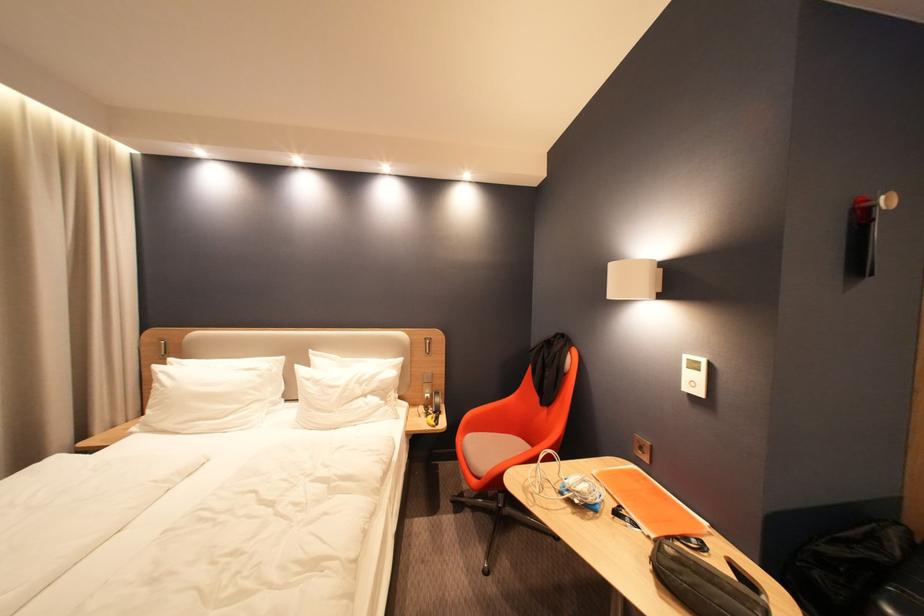
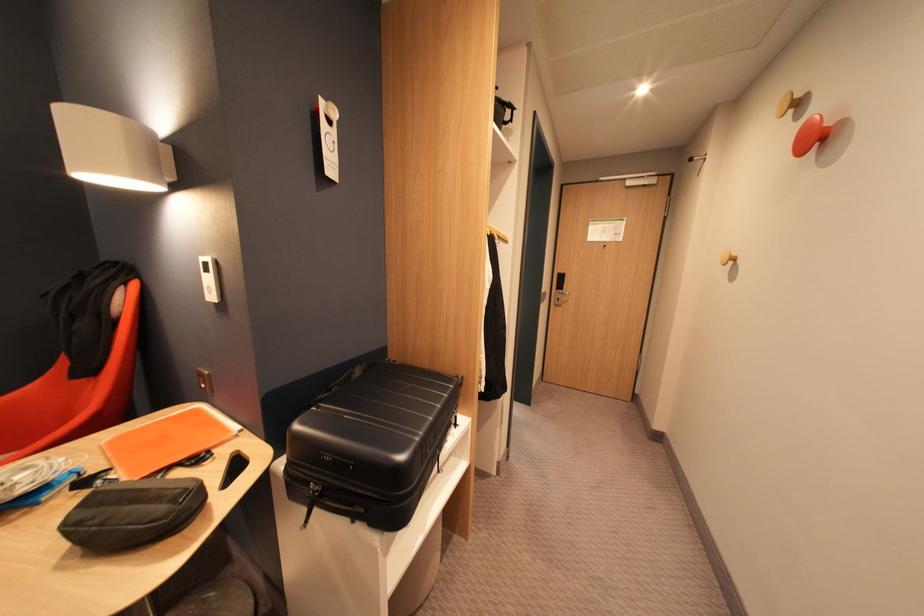
Find the pixel in the second image that matches (636,466) in the first image.

(195, 410)